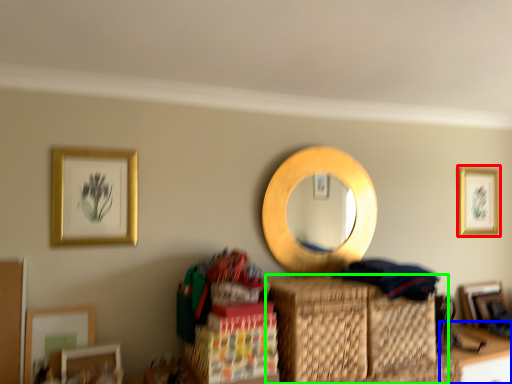
Question: Estimate the real-world distances between objects in this image. Which object is farther from picture frame (highlighted by a red box), table (highlighted by a blue box) or basket (highlighted by a green box)?

Choices:
 (A) table
 (B) basket

Answer: (B)